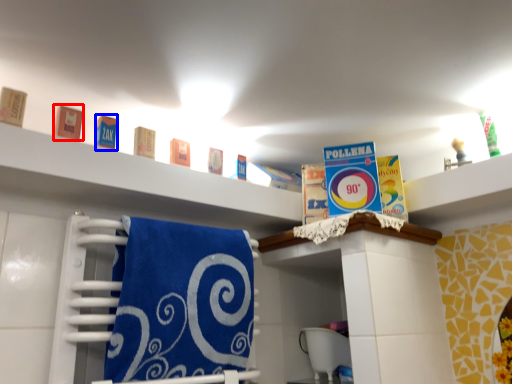
Question: Which object is further to the camera taking this photo, product (highlighted by a red box) or product (highlighted by a blue box)?

Choices:
 (A) product
 (B) product

Answer: (B)